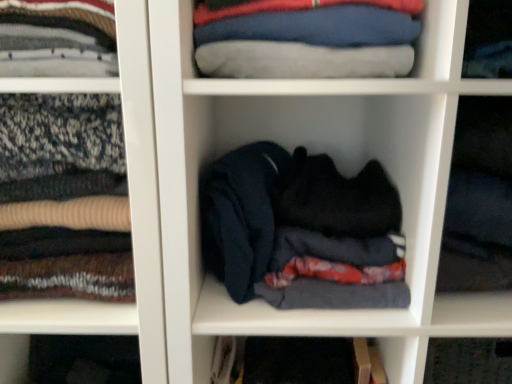
Question: In which direction should I rotate to look at black fabric at center, placed as the third cabinet when sorted from left to right?

Choices:
 (A) left
 (B) right

Answer: (B)

Question: Is black fabric at center, which is counted as the first cabinet, starting from the right, shorter than blue cotton shirt at upper center?

Choices:
 (A) yes
 (B) no

Answer: (B)

Question: Is blue cotton shirt at upper center inside black fabric at center, placed as the third cabinet when sorted from left to right?

Choices:
 (A) yes
 (B) no

Answer: (B)

Question: Can you confirm if black fabric at center, which is counted as the first cabinet, starting from the right, is wider than blue cotton shirt at upper center?

Choices:
 (A) no
 (B) yes

Answer: (B)

Question: Is black fabric at center, placed as the third cabinet when sorted from left to right, thinner than blue cotton shirt at upper center?

Choices:
 (A) yes
 (B) no

Answer: (B)

Question: Can you confirm if black fabric at center, placed as the third cabinet when sorted from left to right, is positioned to the right of blue cotton shirt at upper center?

Choices:
 (A) yes
 (B) no

Answer: (A)

Question: Is dark fabric at center, marked as the second cabinet in a left-to-right arrangement, outside of black fabric at center, placed as the third cabinet when sorted from left to right?

Choices:
 (A) yes
 (B) no

Answer: (A)

Question: Considering the relative sizes of dark fabric at center, which ranks as the 2th cabinet in right-to-left order, and black fabric at center, placed as the third cabinet when sorted from left to right, in the image provided, is dark fabric at center, which ranks as the 2th cabinet in right-to-left order, smaller than black fabric at center, placed as the third cabinet when sorted from left to right,?

Choices:
 (A) no
 (B) yes

Answer: (A)

Question: Could black fabric at center, which is counted as the first cabinet, starting from the right, be considered to be inside dark fabric at center, marked as the second cabinet in a left-to-right arrangement?

Choices:
 (A) no
 (B) yes

Answer: (A)

Question: Is dark fabric at center, which ranks as the 2th cabinet in right-to-left order, at the right side of black fabric at center, placed as the third cabinet when sorted from left to right?

Choices:
 (A) yes
 (B) no

Answer: (B)

Question: Does dark fabric at center, which ranks as the 2th cabinet in right-to-left order, have a larger size compared to black fabric at center, which is counted as the first cabinet, starting from the right?

Choices:
 (A) no
 (B) yes

Answer: (B)

Question: Does dark fabric at center, which ranks as the 2th cabinet in right-to-left order, have a lesser height compared to black fabric at center, placed as the third cabinet when sorted from left to right?

Choices:
 (A) yes
 (B) no

Answer: (A)

Question: Is dark fabric at center, which ranks as the 2th cabinet in right-to-left order, positioned behind dark blue fabric at center, which ranks as the 1th cabinet in left-to-right order?

Choices:
 (A) no
 (B) yes

Answer: (B)